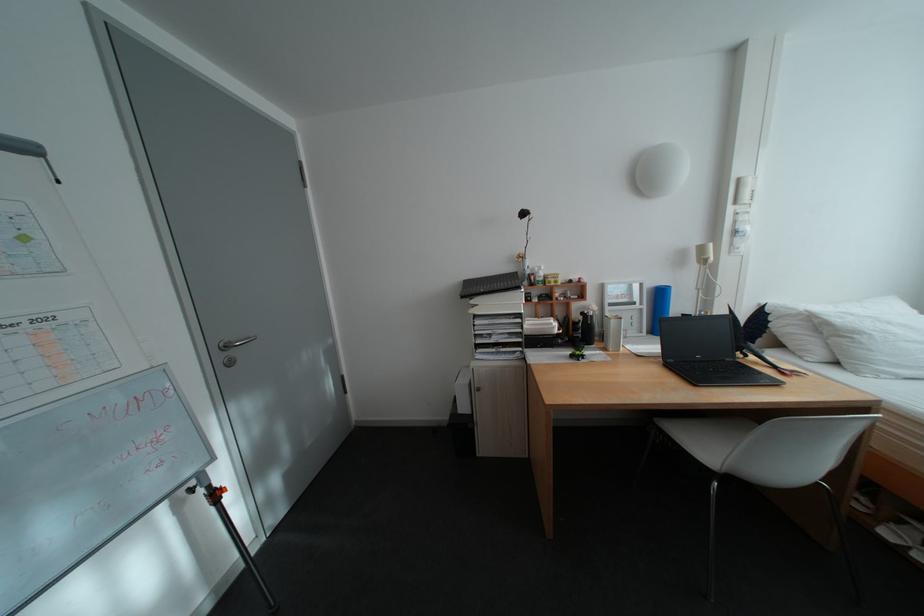
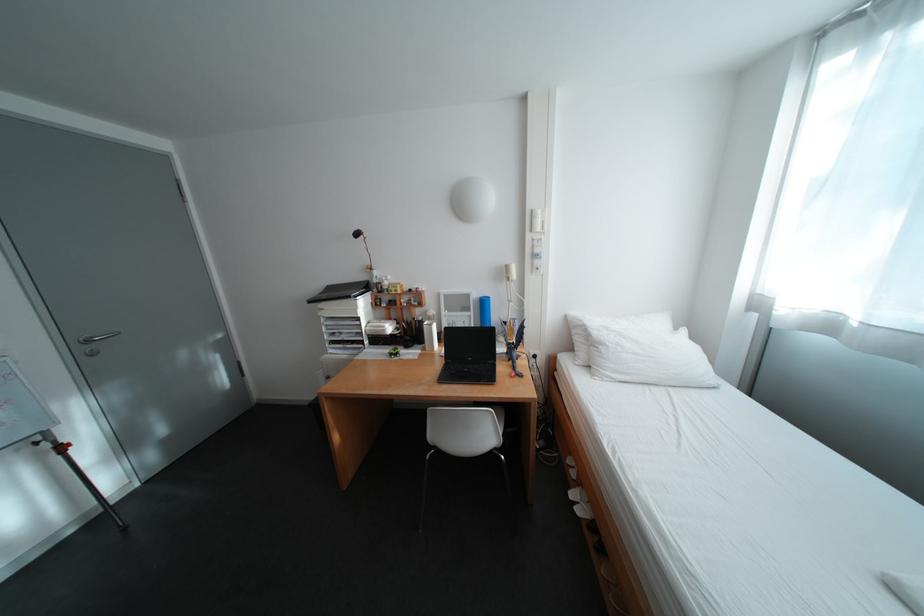
Where in the second image is the point corresponding to the point at 602,323 from the first image?

(430, 326)